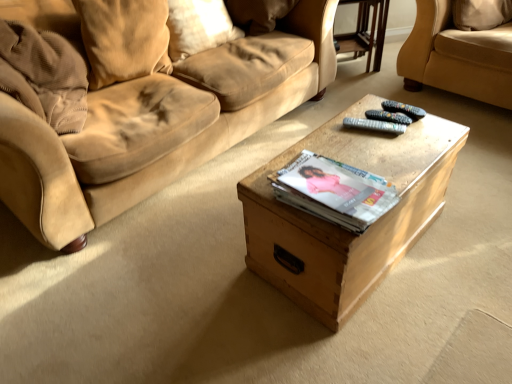
The height and width of the screenshot is (384, 512). I want to click on free spot in front of wooden box at center, so click(x=380, y=331).